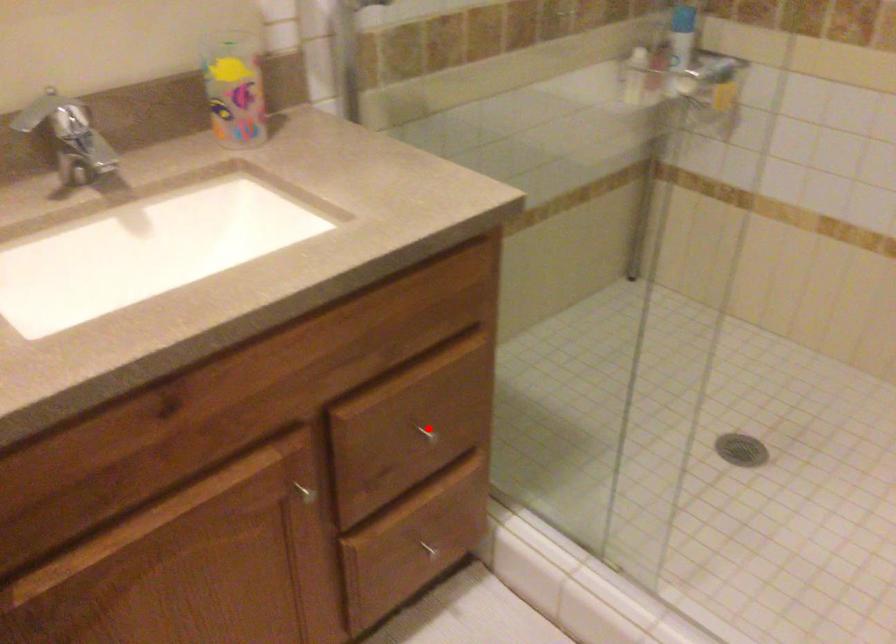
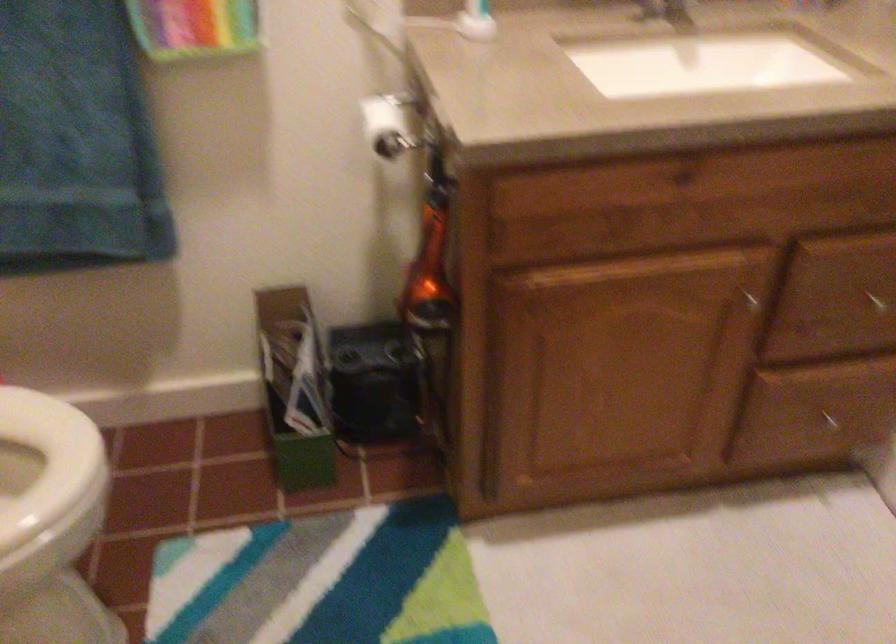
The point at the highlighted location is marked in the first image. Where is the corresponding point in the second image?

(875, 301)